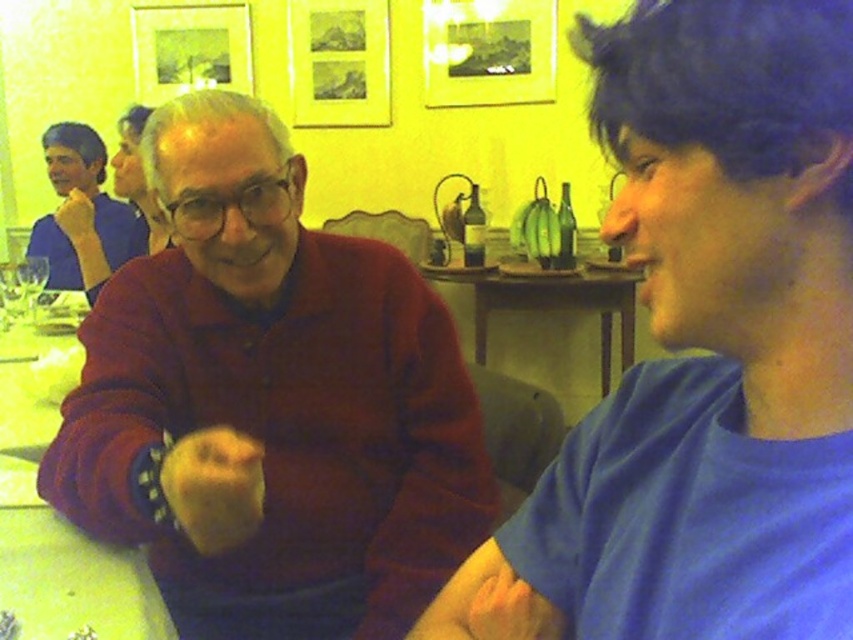
Question: Which is farther from the transparent plastic wine glass at lower left?

Choices:
 (A) matte red sweater at center
 (B) matte blue shirt at left

Answer: (A)

Question: Does wooden at center have a smaller size compared to transparent plastic wine glass at lower left?

Choices:
 (A) no
 (B) yes

Answer: (A)

Question: Which point appears farthest from the camera in this image?

Choices:
 (A) (531, 307)
 (B) (241, 433)
 (C) (21, 310)
 (D) (84, 138)

Answer: (D)

Question: Which point appears farthest from the camera in this image?

Choices:
 (A) (28, 285)
 (B) (215, 512)
 (C) (26, 595)

Answer: (A)

Question: Does matte blue shirt at left have a larger size compared to yellow matte apple at lower left?

Choices:
 (A) no
 (B) yes

Answer: (B)

Question: From the image, what is the correct spatial relationship of wooden at center in relation to transparent plastic wine glass at lower left?

Choices:
 (A) left
 (B) right

Answer: (B)